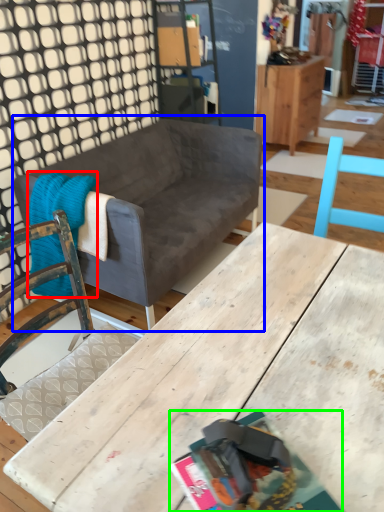
Question: Based on their relative distances, which object is nearer to blanket (highlighted by a red box)? Choose from studio couch (highlighted by a blue box) and magazine (highlighted by a green box).

Choices:
 (A) studio couch
 (B) magazine

Answer: (A)